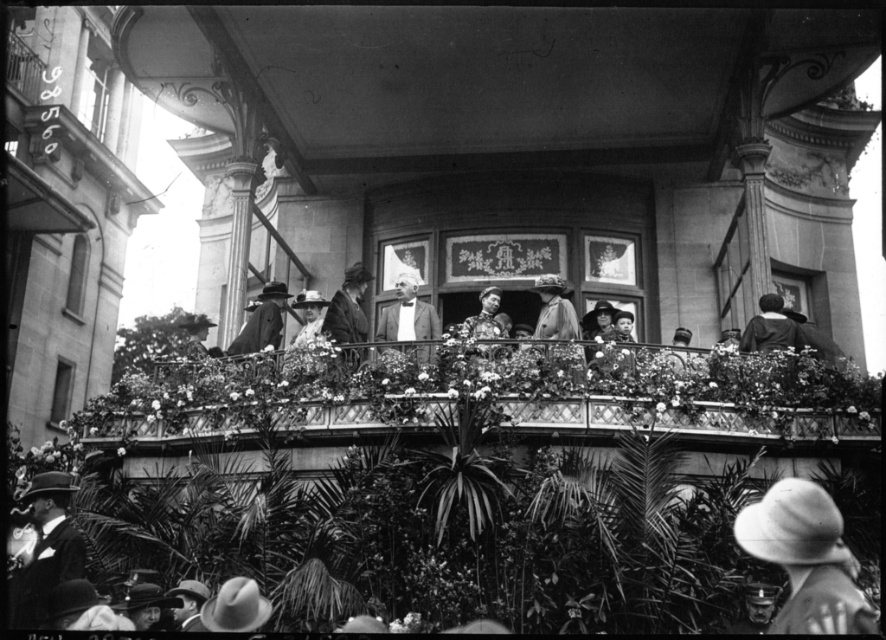
You are a photographer trying to capture a candid shot of the smooth black suit at lower left and the smooth leather jacket at center. You need to ensure that both subjects are fully visible in the frame. Based on their widths, which subject requires more space in the horizontal direction?

The smooth black suit at lower left might require more space in the horizontal direction since it might be wider than the smooth leather jacket at center.

From the picture: You are standing on the balcony and want to walk from the point at coordinates point (346, 353) to the point at coordinates point (498, 321). Will you be moving towards the front or the back of the balcony?

You will be moving towards the back of the balcony because point (498, 321) is behind point (346, 353).

You are standing on the balcony and want to place your hand on the wooden railing at center and the smooth leather jacket at center. Which object will your hand touch first?

The wooden railing at center is closer to the viewer than the smooth leather jacket at center, so your hand will touch the wooden railing at center first.